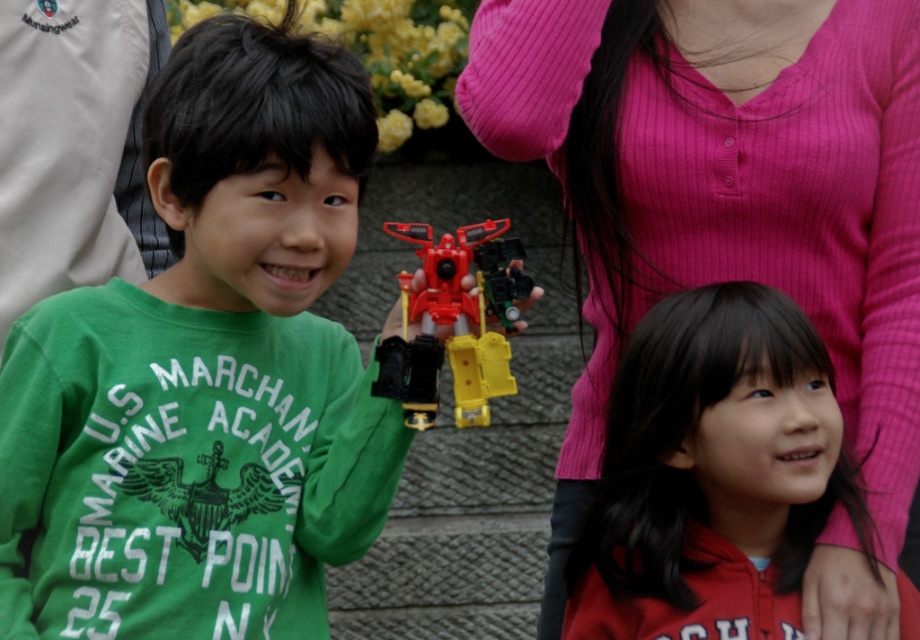
Is green matte shirt at left wider than pink ribbed sweater at upper center?

No.

Is green matte shirt at left thinner than pink ribbed sweater at upper center?

Correct, green matte shirt at left's width is less than pink ribbed sweater at upper center's.

Who is more forward, (331, 410) or (897, 218)?

Point (331, 410) is in front.

At what (x,y) coordinates should I click in order to perform the action: click on green matte shirt at left. Please return your answer as a coordinate pair (x, y). The height and width of the screenshot is (640, 920). Looking at the image, I should click on (207, 372).

Who is taller, green matte shirt at left or matte red hoodie at center?

green matte shirt at left is taller.

Is point (84, 636) behind point (691, 483)?

That is False.

Identify the location of green matte shirt at left. (207, 372).

From the picture: Is matte red hoodie at center shorter than matte plastic robot at center?

Incorrect, matte red hoodie at center's height does not fall short of matte plastic robot at center's.

Between point (710, 448) and point (422, 403), which one is positioned behind?

Positioned behind is point (710, 448).

This screenshot has width=920, height=640. I want to click on matte red hoodie at center, so click(713, 474).